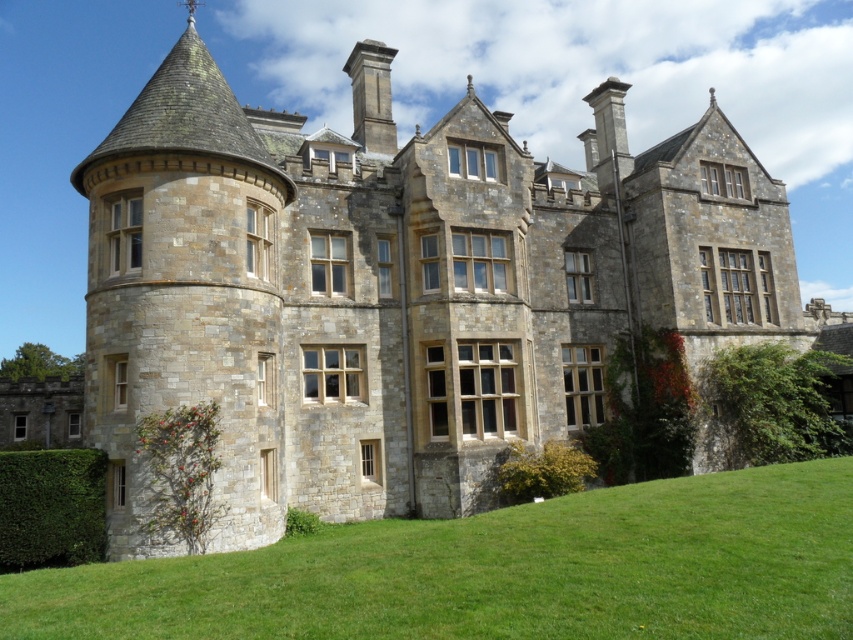
Question: Does green leafy hedge at right appear on the left side of green leafy hedge at lower center?

Choices:
 (A) yes
 (B) no

Answer: (B)

Question: Does green grass at lower center have a smaller size compared to green leafy hedge at lower left?

Choices:
 (A) yes
 (B) no

Answer: (B)

Question: Which object is the closest to the green grass at lower center?

Choices:
 (A) green leafy hedge at lower left
 (B) green leafy hedge at right

Answer: (A)

Question: Does green leafy hedge at right appear over green leafy hedge at lower center?

Choices:
 (A) yes
 (B) no

Answer: (A)

Question: Estimate the real-world distances between objects in this image. Which object is farther from the green grass at lower center?

Choices:
 (A) green leafy hedge at lower center
 (B) green leafy hedge at right
 (C) green leafy hedge at lower left

Answer: (B)

Question: Which point is farther to the camera?

Choices:
 (A) (517, 497)
 (B) (22, 483)

Answer: (A)